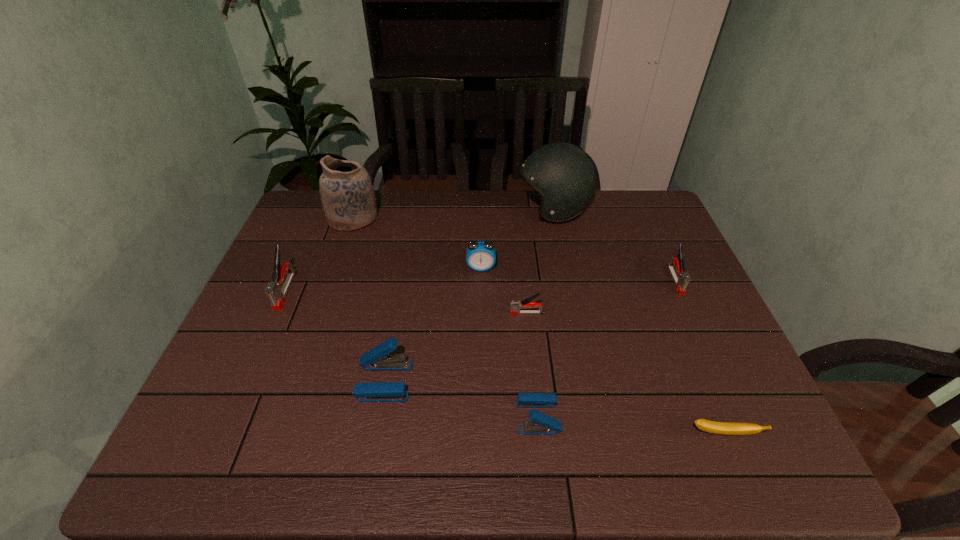
This screenshot has height=540, width=960. Find the location of `banana that is at the near edge`. banana that is at the near edge is located at coordinates (728, 428).

You are a GUI agent. You are given a task and a screenshot of the screen. Output one action in this format:
    pyautogui.click(x=<x>, y=<y>)
    Task: Click on the pottery that is positioned at the left edge
    Image resolution: width=960 pixels, height=540 pixels.
    Given the screenshot: What is the action you would take?
    pyautogui.click(x=347, y=193)

Find the location of `stapler that is positioned at the left edge`. stapler that is positioned at the left edge is located at coordinates (276, 293).

What are the coordinates of `stapler that is at the right edge` in the screenshot? It's located at (681, 278).

Where is `banana located at the right edge`? banana located at the right edge is located at coordinates (728, 428).

Where is `object present at the far left corner`? Image resolution: width=960 pixels, height=540 pixels. object present at the far left corner is located at coordinates (347, 193).

The width and height of the screenshot is (960, 540). I want to click on object present at the near right corner, so click(728, 428).

This screenshot has height=540, width=960. What are the coordinates of `free location at the far edge of the desktop` in the screenshot? It's located at (423, 218).

Find the location of a particular element. The height and width of the screenshot is (540, 960). vacant space at the near edge of the desktop is located at coordinates (579, 451).

Image resolution: width=960 pixels, height=540 pixels. Identify the location of free point at the left edge. (320, 275).